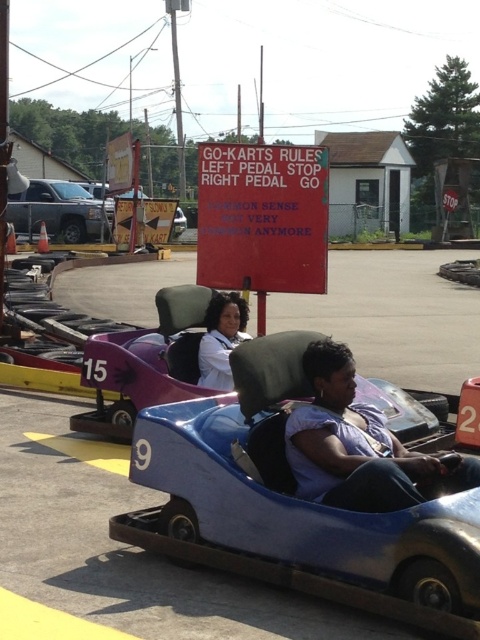
Question: Does blue plastic go-kart at center appear over white matte jacket at center?

Choices:
 (A) no
 (B) yes

Answer: (A)

Question: Among these points, which one is farthest from the camera?

Choices:
 (A) (230, 348)
 (B) (405, 432)
 (C) (355, 378)

Answer: (A)

Question: Which object is farther from the camera taking this photo?

Choices:
 (A) blue plastic go-kart at center
 (B) white matte jacket at center

Answer: (B)

Question: Is metallic blue go-kart at center behind purple matte shirt at center?

Choices:
 (A) yes
 (B) no

Answer: (B)

Question: Does silver metallic truck at left appear over white matte jacket at center?

Choices:
 (A) yes
 (B) no

Answer: (A)

Question: Estimate the real-world distances between objects in this image. Which object is closer to the silver metallic truck at left?

Choices:
 (A) blue plastic go-kart at center
 (B) metallic blue go-kart at center
 (C) white matte jacket at center
 (D) purple matte shirt at center

Answer: (C)